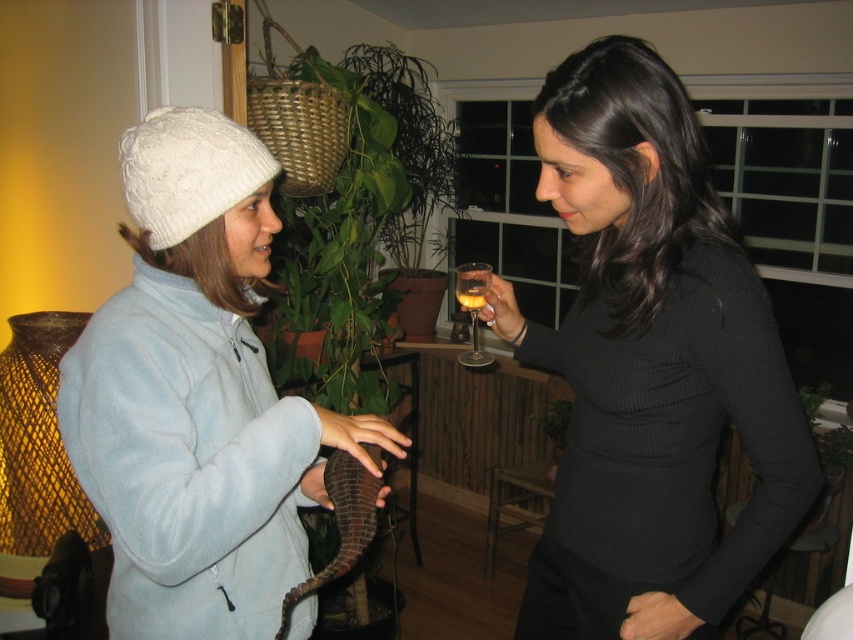
You are standing at the origin point of the coordinate system. You see a point labeled as point (196, 396). Based on the scene description, which object does this point belong to?

The point (196, 396) is on the white fuzzy hat at left.